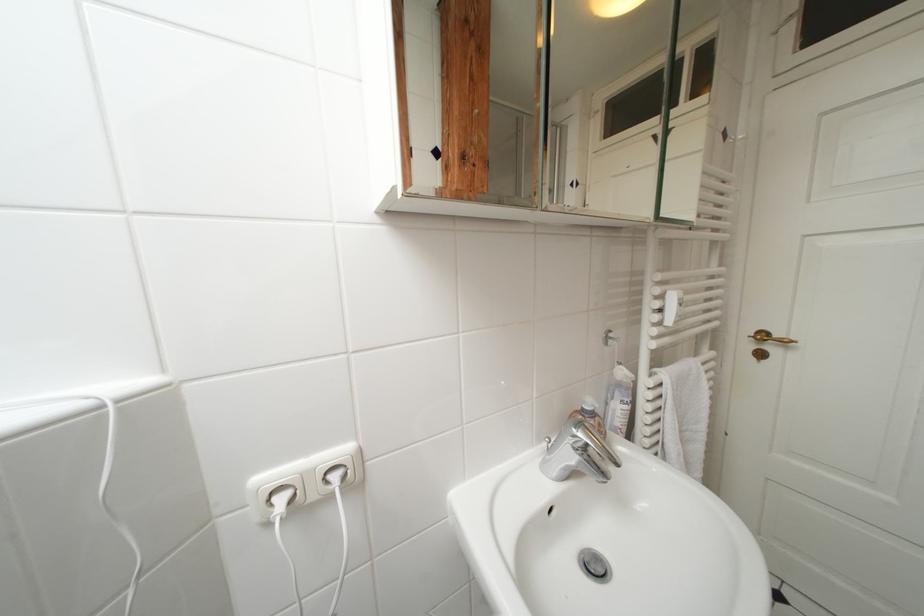
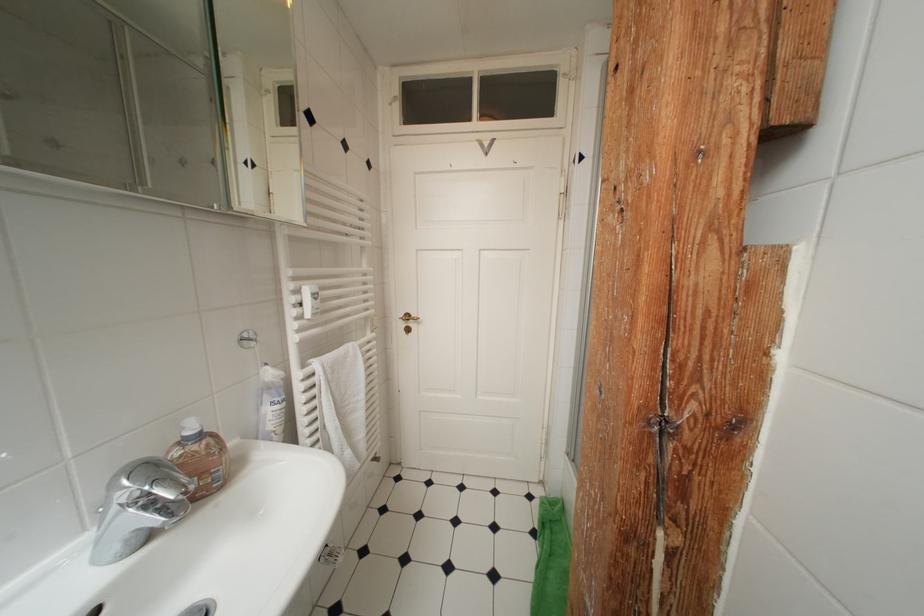
Question: The camera is either moving clockwise (left) or counter-clockwise (right) around the object. The first image is from the beginning of the video and the second image is from the end. Is the camera moving left or right when shooting the video?

Choices:
 (A) Left
 (B) Right

Answer: (A)